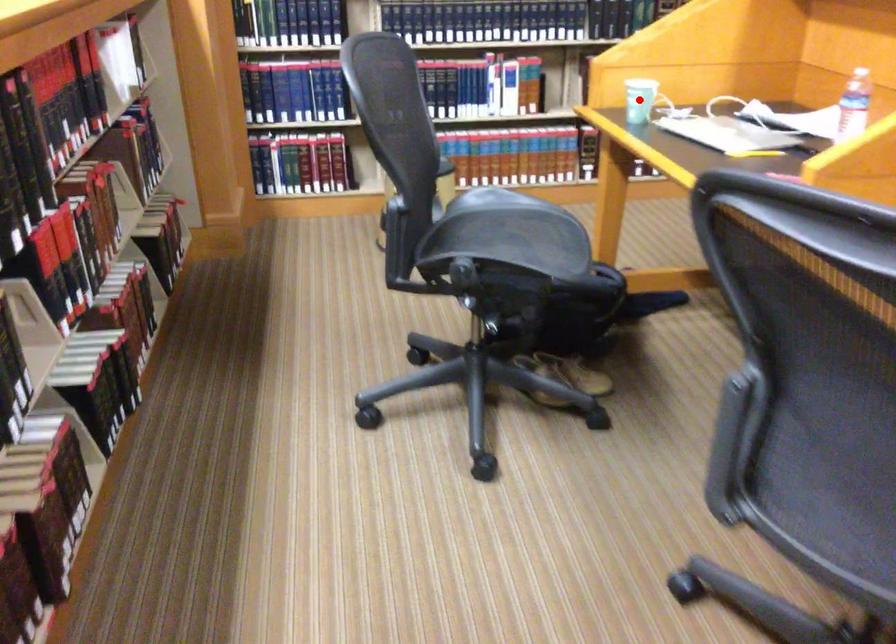
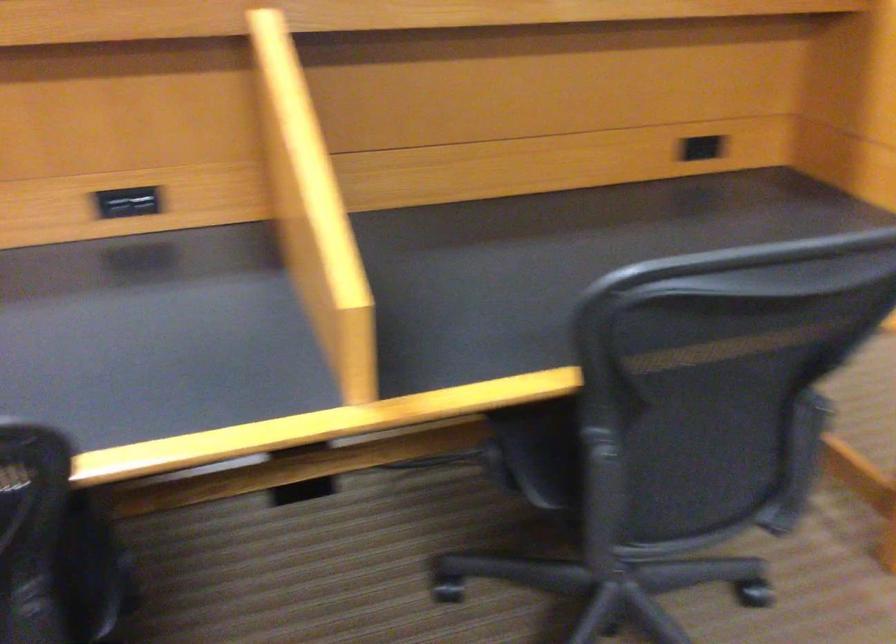
Question: I am providing you with two images of the same scene from different viewpoints. A red point is marked on the first image. Can you still see the location of the red point in image 2?

Choices:
 (A) Yes
 (B) No

Answer: (B)